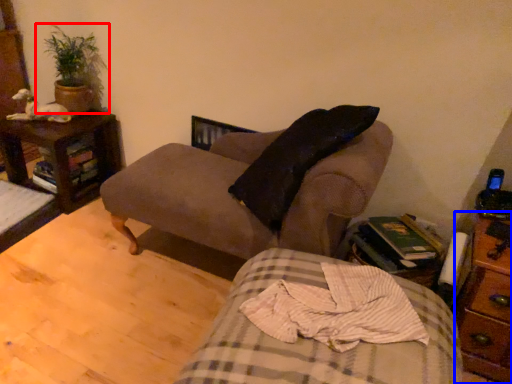
Question: Which object is further to the camera taking this photo, houseplant (highlighted by a red box) or nightstand (highlighted by a blue box)?

Choices:
 (A) houseplant
 (B) nightstand

Answer: (A)